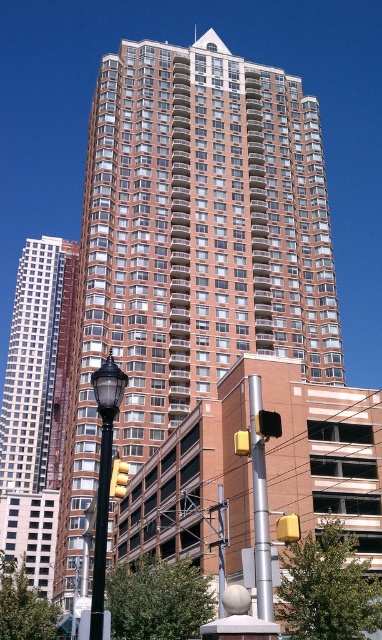
Question: Considering the real-world distances, which object is closest to the black plastic traffic light at center?

Choices:
 (A) yellow plastic traffic light at center
 (B) black metal pole at center
 (C) shiny glass skyscraper at left

Answer: (A)

Question: Is brown glassy building at center closer to camera compared to yellowtransparent glasstraffic light at center?

Choices:
 (A) yes
 (B) no

Answer: (B)

Question: Which point is farther to the camera?

Choices:
 (A) (268, 433)
 (B) (289, 515)
 (C) (55, 282)

Answer: (C)

Question: Does black polished streetlight at lower left appear under yellow plastic traffic light at center?

Choices:
 (A) no
 (B) yes

Answer: (A)

Question: Based on their relative distances, which object is nearer to the yellowtransparent glasstraffic light at center?

Choices:
 (A) yellow matte traffic light at center
 (B) shiny glass skyscraper at left
 (C) black plastic traffic light at center

Answer: (C)

Question: Does brown glassy building at center have a lesser width compared to yellow plastic traffic light at center?

Choices:
 (A) yes
 (B) no

Answer: (B)